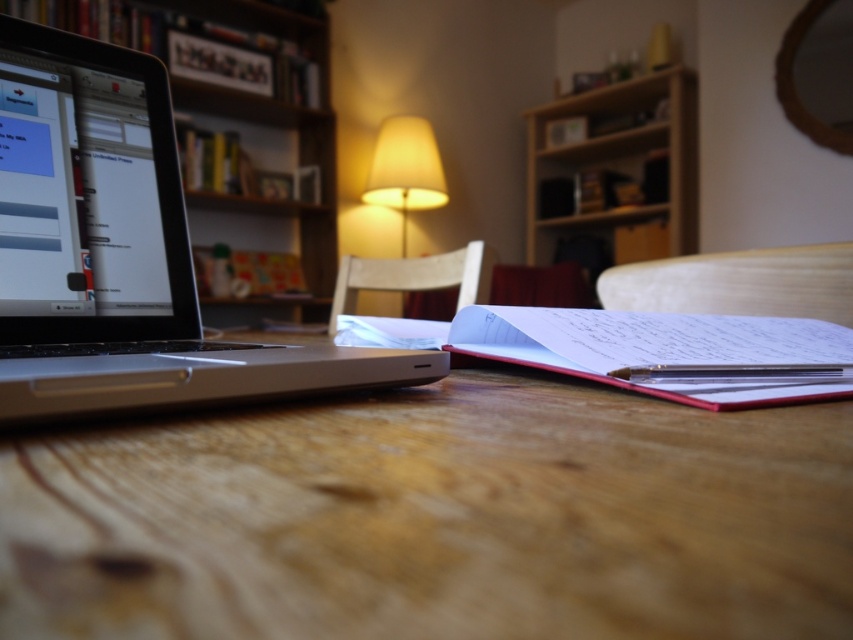
You are organizing a small event in this room and need to place a 15cm tall decoration. You have the silver metallic laptop at left and the wooden bookshelf at upper center. Which object can the decoration be placed on top of without exceeding its height?

The decoration can be placed on the wooden bookshelf at upper center because the silver metallic laptop at left has a lesser height compared to wooden bookshelf at upper center, so the bookshelf can support the decoration without exceeding its height.

You are organizing your desk and need to place a new folder between the white paper notebook at center and the wooden bookshelf at upper center. Based on their positions, where should you place the folder?

The white paper notebook at center is to the left of the wooden bookshelf at upper center, so you should place the folder between them to the right of the notebook and left of the bookshelf.

You are organizing your desk and need to know if the white paper notebook at center can be placed on the wooden bookshelf at upper center. Based on their sizes, will it fit?

The white paper notebook at center occupies less space than wooden bookshelf at upper center, so it will fit on the shelf.